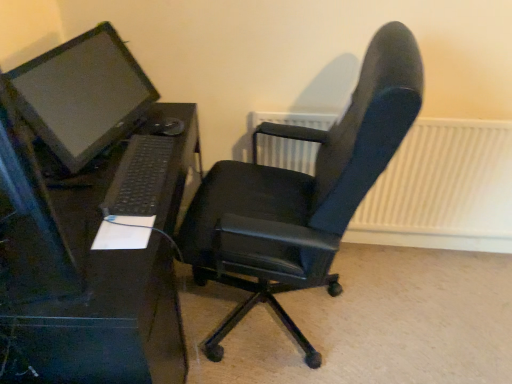
Question: From a real-world perspective, is white textured radiator at upper right located higher than black plastic keyboard at lower left?

Choices:
 (A) yes
 (B) no

Answer: (B)

Question: Is white textured radiator at upper right oriented away from black plastic keyboard at lower left?

Choices:
 (A) yes
 (B) no

Answer: (B)

Question: Is white textured radiator at upper right further to the viewer compared to black plastic keyboard at lower left?

Choices:
 (A) yes
 (B) no

Answer: (A)

Question: Can you confirm if white textured radiator at upper right is thinner than black plastic keyboard at lower left?

Choices:
 (A) yes
 (B) no

Answer: (A)

Question: From a real-world perspective, is white textured radiator at upper right under black plastic keyboard at lower left?

Choices:
 (A) no
 (B) yes

Answer: (B)

Question: Looking at their shapes, would you say black leather office chair at center is wider or thinner than black plastic desk at left?

Choices:
 (A) wide
 (B) thin

Answer: (A)

Question: Would you say black leather office chair at center is inside or outside black plastic desk at left?

Choices:
 (A) inside
 (B) outside

Answer: (B)

Question: From their relative heights in the image, would you say black leather office chair at center is taller or shorter than black plastic desk at left?

Choices:
 (A) short
 (B) tall

Answer: (B)

Question: Considering the positions of black leather office chair at center and black plastic desk at left in the image, is black leather office chair at center bigger or smaller than black plastic desk at left?

Choices:
 (A) small
 (B) big

Answer: (B)

Question: In the image, is matte black monitor at left on the left side or the right side of black plastic desk at left?

Choices:
 (A) left
 (B) right

Answer: (A)

Question: Is point (22, 66) closer or farther from the camera than point (46, 195)?

Choices:
 (A) closer
 (B) farther

Answer: (B)

Question: Considering the positions of matte black monitor at left and black plastic desk at left in the image, is matte black monitor at left taller or shorter than black plastic desk at left?

Choices:
 (A) short
 (B) tall

Answer: (A)

Question: From a real-world perspective, is matte black monitor at left positioned above or below black plastic desk at left?

Choices:
 (A) above
 (B) below

Answer: (A)

Question: In the image, is black plastic desk at left positioned in front of or behind matte black monitor at left?

Choices:
 (A) front
 (B) behind

Answer: (A)

Question: In terms of width, does black plastic desk at left look wider or thinner when compared to matte black monitor at left?

Choices:
 (A) wide
 (B) thin

Answer: (A)